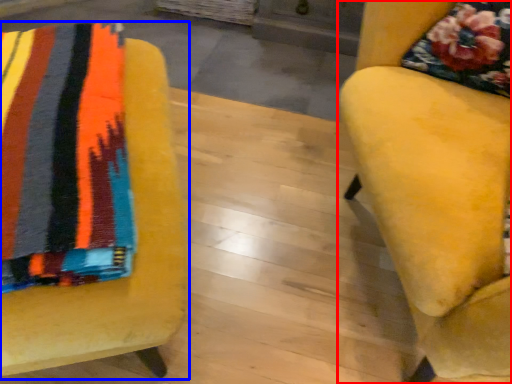
Question: Which point is further to the camera, chair (highlighted by a red box) or chair (highlighted by a blue box)?

Choices:
 (A) chair
 (B) chair

Answer: (B)